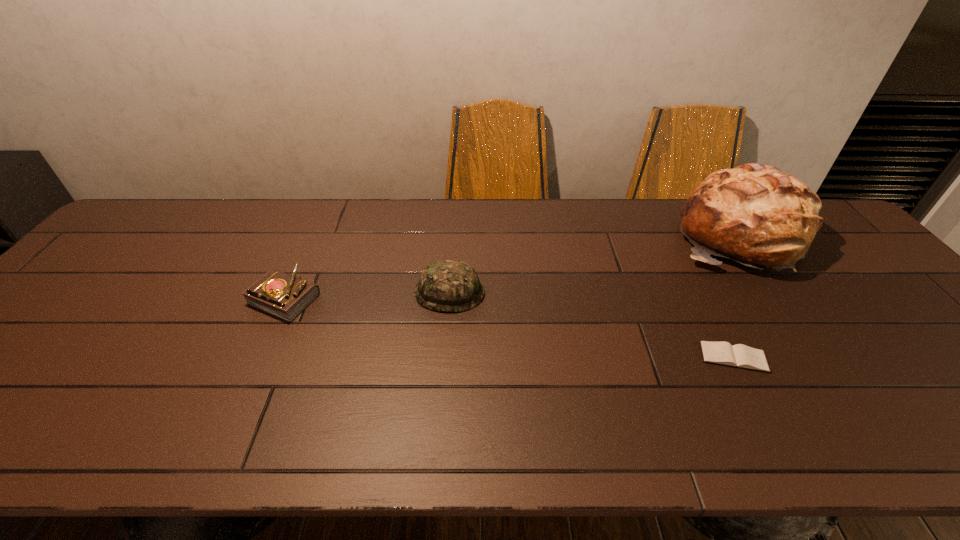
Identify the location of vacant area in the image that satisfies the following two spatial constraints: 1. on the front side of the left diary; 2. on the right side of the shortest object. (258, 357).

Where is `free space that satisfies the following two spatial constraints: 1. on the front side of the shorter diary; 2. on the left side of the leftmost object`? free space that satisfies the following two spatial constraints: 1. on the front side of the shorter diary; 2. on the left side of the leftmost object is located at coordinates (x=258, y=357).